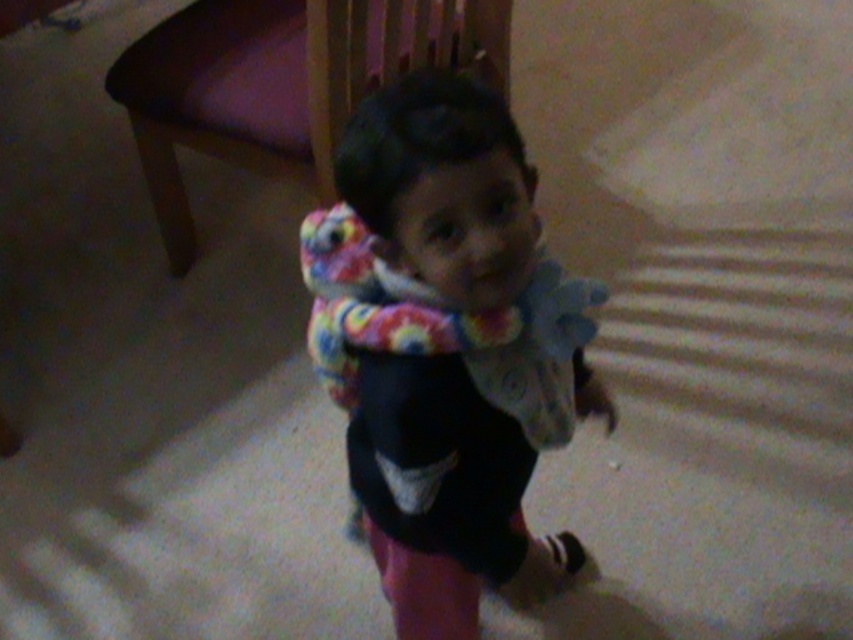
Question: Which point is farther to the camera?

Choices:
 (A) (286, 13)
 (B) (335, 216)

Answer: (A)

Question: Can you confirm if soft fleece sweater at center is positioned to the right of wooden chair at upper left?

Choices:
 (A) yes
 (B) no

Answer: (A)

Question: Based on their relative distances, which object is nearer to the soft fleece sweater at center?

Choices:
 (A) fluffy multicolored scarf at center
 (B) wooden chair at upper left

Answer: (A)

Question: Where is wooden chair at upper left located in relation to fluffy multicolored scarf at center in the image?

Choices:
 (A) below
 (B) above

Answer: (B)

Question: Where is soft fleece sweater at center located in relation to fluffy multicolored scarf at center in the image?

Choices:
 (A) above
 (B) below

Answer: (B)

Question: Which point is closer to the camera?

Choices:
 (A) pyautogui.click(x=509, y=348)
 (B) pyautogui.click(x=340, y=362)
 (C) pyautogui.click(x=236, y=56)

Answer: (A)